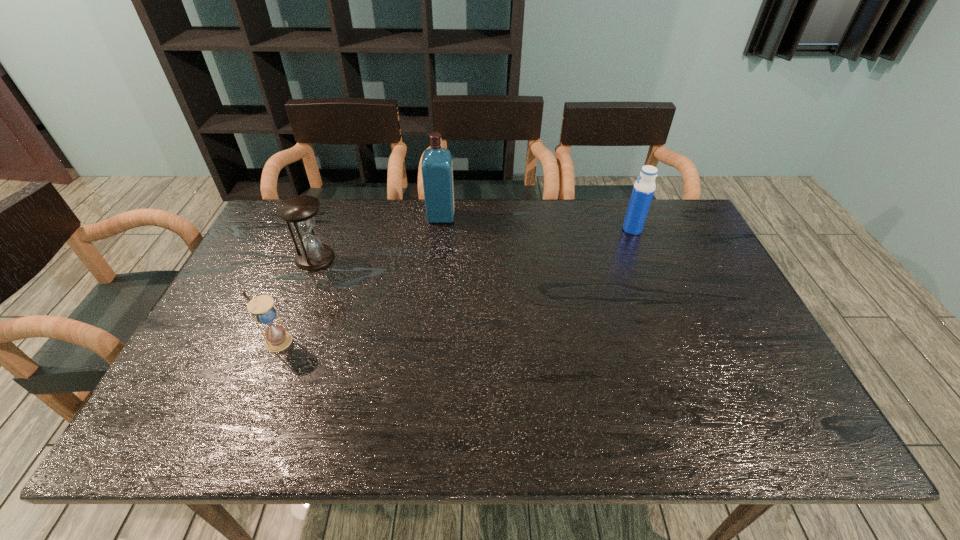
Find the location of a particular element. unoccupied position between the nearest object and the tallest object is located at coordinates (359, 279).

You are a GUI agent. You are given a task and a screenshot of the screen. Output one action in this format:
    pyautogui.click(x=<x>, y=<y>)
    Task: Click on the free spot between the shortest object and the second nearest object
    The width and height of the screenshot is (960, 540).
    Given the screenshot: What is the action you would take?
    pyautogui.click(x=296, y=300)

The width and height of the screenshot is (960, 540). Find the location of `empty space that is in between the liquor and the shortest object`. empty space that is in between the liquor and the shortest object is located at coordinates (359, 279).

Identify the location of vacant point located between the tallest object and the third farthest object. (378, 237).

Image resolution: width=960 pixels, height=540 pixels. What are the coordinates of `vacant point located between the farther hourglass and the nearest object` in the screenshot? It's located at (296, 300).

The image size is (960, 540). I want to click on unoccupied position between the third tallest object and the second object from right to left, so click(x=378, y=237).

You are a GUI agent. You are given a task and a screenshot of the screen. Output one action in this format:
    pyautogui.click(x=<x>, y=<y>)
    Task: Click on the unoccupied position between the taller hourglass and the shortest object
    
    Given the screenshot: What is the action you would take?
    pyautogui.click(x=296, y=300)

Locate an element on the screen. Image resolution: width=960 pixels, height=540 pixels. free area in between the shortest object and the tallest object is located at coordinates (359, 279).

This screenshot has height=540, width=960. Identify the location of free area in between the water bottle and the third object from left to right. (537, 223).

This screenshot has width=960, height=540. In order to click on empty location between the nearest object and the third tallest object in this screenshot , I will do point(296,300).